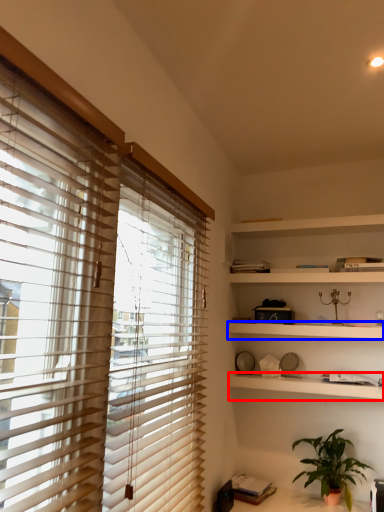
Question: Among these objects, which one is nearest to the camera, shelf (highlighted by a red box) or shelf (highlighted by a blue box)?

Choices:
 (A) shelf
 (B) shelf

Answer: (A)